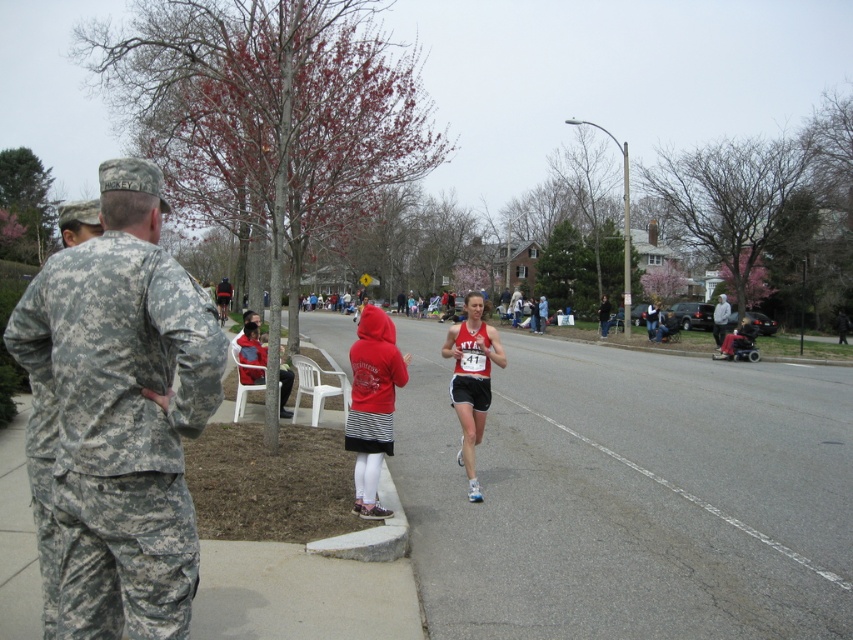
Question: From the image, what is the correct spatial relationship of gray hoodie at center in relation to dark blue jacket at center?

Choices:
 (A) left
 (B) right

Answer: (B)

Question: Can you confirm if red hoodie at center is positioned to the left of matte red running outfit at center?

Choices:
 (A) yes
 (B) no

Answer: (A)

Question: Which is farther from the gray asphalt road at center?

Choices:
 (A) camouflage uniform at left
 (B) red hoodie at center
 (C) matte red running outfit at center

Answer: (B)

Question: Among these objects, which one is farthest from the camera?

Choices:
 (A) red hoodie at center
 (B) dark blue jacket at center

Answer: (B)

Question: Is matte red running outfit at center bigger than gray hoodie at center?

Choices:
 (A) yes
 (B) no

Answer: (B)

Question: Which point is farther to the camera?

Choices:
 (A) (375, 440)
 (B) (158, 509)
 (C) (660, 481)
 (D) (247, 333)

Answer: (D)